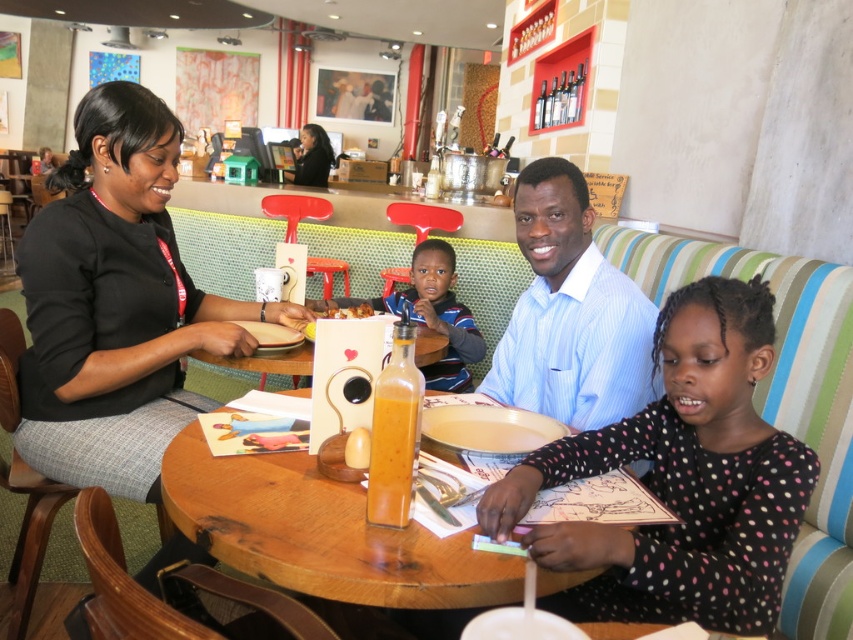
Is wooden round table at center shorter than white cardboard box at center?

Indeed, wooden round table at center has a lesser height compared to white cardboard box at center.

The height and width of the screenshot is (640, 853). What do you see at coordinates (267, 362) in the screenshot? I see `wooden round table at center` at bounding box center [267, 362].

Measure the distance between wooden round table at center and camera.

wooden round table at center is 1.56 meters away from camera.

You are a GUI agent. You are given a task and a screenshot of the screen. Output one action in this format:
    pyautogui.click(x=<x>, y=<y>)
    Task: Click on the wooden round table at center
    
    Given the screenshot: What is the action you would take?
    pyautogui.click(x=267, y=362)

Can you confirm if black matte jacket at left is taller than wooden round table at center?

Correct, black matte jacket at left is much taller as wooden round table at center.

Where is `black matte jacket at left`? This screenshot has height=640, width=853. black matte jacket at left is located at coordinates (117, 305).

The width and height of the screenshot is (853, 640). In order to click on black matte jacket at left in this screenshot , I will do `click(117, 305)`.

Can you confirm if black matte jacket at left is positioned to the right of matte black hair at upper center?

Correct, you'll find black matte jacket at left to the right of matte black hair at upper center.

Consider the image. Between black matte jacket at left and matte black hair at upper center, which one has less height?

With less height is matte black hair at upper center.

Is point (144, 264) positioned after point (302, 184)?

No, it is not.

The height and width of the screenshot is (640, 853). What are the coordinates of `black matte jacket at left` in the screenshot? It's located at (117, 305).